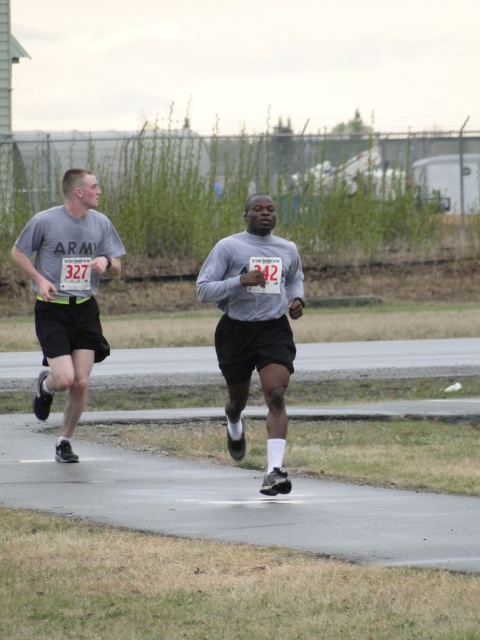
You are a photographer positioned at the starting line of the race. You want to capture a photo where both the gray matte shirt at center and the matte gray shirt at left are visible. Given their heights, which runner should you focus on to ensure both are in frame without cropping?

The gray matte shirt at center is shorter than the matte gray shirt at left. To ensure both are visible without cropping, focus on the taller runner, the matte gray shirt at left, as they will be easier to frame while including the shorter runner.

You are a photographer positioned at the starting line of the running event. You want to take a photo that includes both the point at coordinates (420, 502) and the point at coordinates (83, 230). Which point should you focus on first to ensure both are in focus?

You should focus on the point at coordinates (83, 230) first because it is farther from the camera than the point at coordinates (420, 502). By focusing on the farther point, both points will be within the depth of field and in focus.